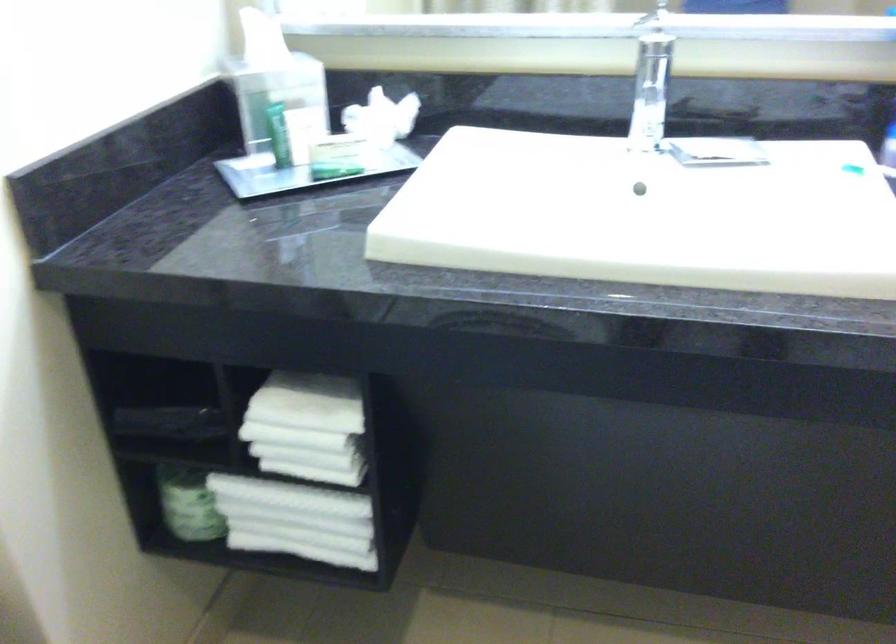
This screenshot has width=896, height=644. In order to click on faucet lever handle in this screenshot , I will do `click(653, 24)`.